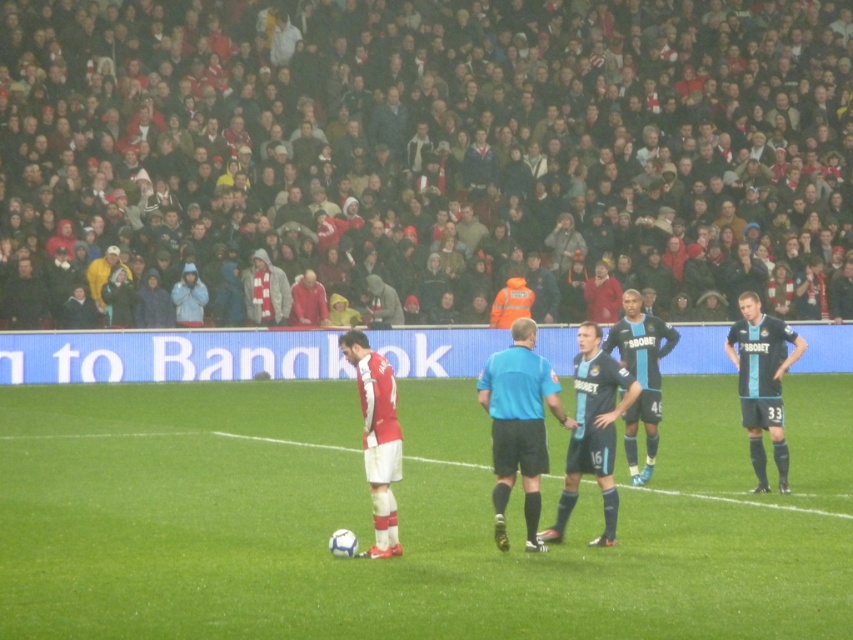
Question: Is dark gray hoodies at upper center smaller than blue jersey at center?

Choices:
 (A) no
 (B) yes

Answer: (A)

Question: Is blue fabric referee at center further to camera compared to dark blue jersey at center?

Choices:
 (A) no
 (B) yes

Answer: (A)

Question: Can you confirm if dark gray hoodies at upper center is bigger than white matte football at center?

Choices:
 (A) yes
 (B) no

Answer: (A)

Question: Estimate the real-world distances between objects in this image. Which object is farther from the blue fabric referee at center?

Choices:
 (A) blue jersey at center
 (B) white matte football at center
 (C) green grass football field at center
 (D) dark gray hoodies at upper center

Answer: (D)

Question: Which of the following is the farthest from the observer?

Choices:
 (A) white matte football at center
 (B) blue jersey at center

Answer: (B)

Question: Which point is closer to the camera?

Choices:
 (A) white matte football at center
 (B) green grass football field at center
 (C) blue fabric referee at center

Answer: (B)